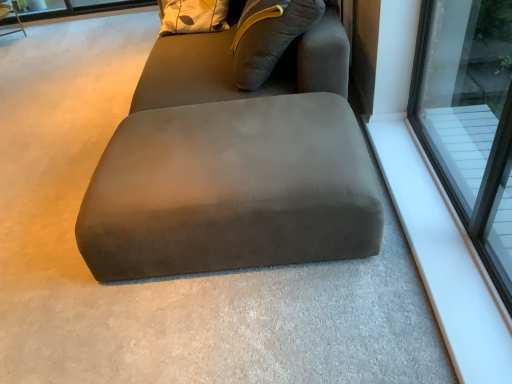
Question: Is point (332, 56) positioned closer to the camera than point (13, 31)?

Choices:
 (A) closer
 (B) farther

Answer: (A)

Question: Is suede gray bean bag at center wider or thinner than wooden swivel chair at upper left?

Choices:
 (A) thin
 (B) wide

Answer: (B)

Question: Which of these objects is positioned closest to the wooden swivel chair at upper left?

Choices:
 (A) suede gray bean bag at center
 (B) transparent glass window at upper right
 (C) white smooth window sill at upper right
 (D) suede ottoman at center

Answer: (A)

Question: Based on their relative distances, which object is nearer to the transparent glass window at upper right?

Choices:
 (A) white smooth window sill at upper right
 (B) suede ottoman at center
 (C) suede gray bean bag at center
 (D) wooden swivel chair at upper left

Answer: (A)